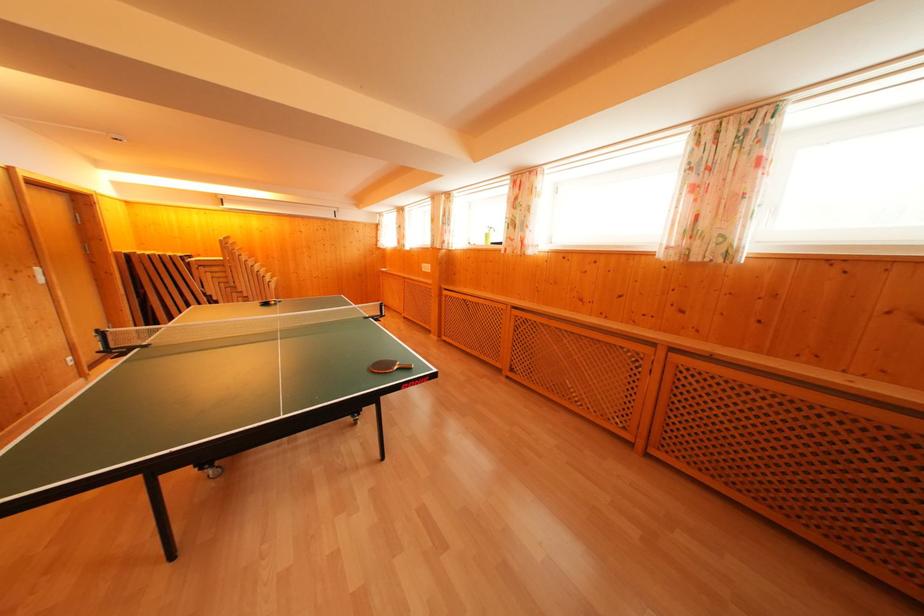
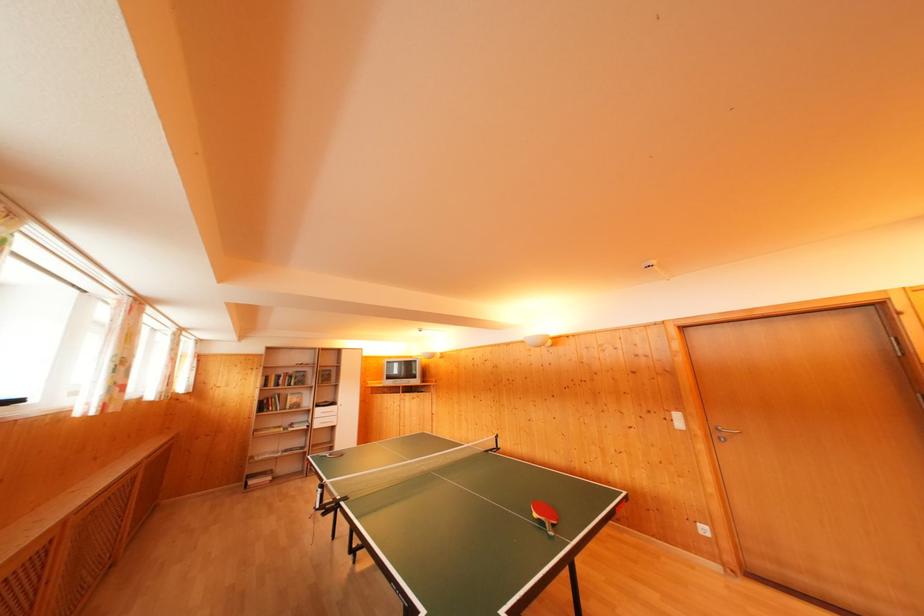
Find the pixel in the second image that matches (43,276) in the first image.

(682, 421)